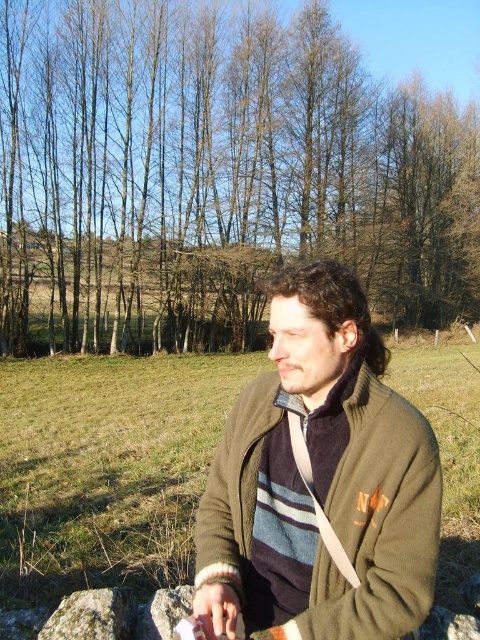
Question: Which of these objects is positioned closest to the green mossy rock at lower left?

Choices:
 (A) brown bark tree at upper center
 (B) green fuzzy sweater at center

Answer: (B)

Question: Is green fuzzy sweater at center wider than green mossy rock at lower left?

Choices:
 (A) yes
 (B) no

Answer: (A)

Question: Which of the following is the closest to the observer?

Choices:
 (A) brown bark tree at upper center
 (B) green fuzzy sweater at center

Answer: (B)

Question: Can you confirm if brown bark tree at upper center is bigger than green mossy rock at lower left?

Choices:
 (A) yes
 (B) no

Answer: (A)

Question: Among these objects, which one is nearest to the camera?

Choices:
 (A) green fuzzy sweater at center
 (B) green mossy rock at lower left
 (C) brown bark tree at upper center

Answer: (A)

Question: Can you confirm if green fuzzy sweater at center is positioned to the right of green mossy rock at lower left?

Choices:
 (A) yes
 (B) no

Answer: (A)